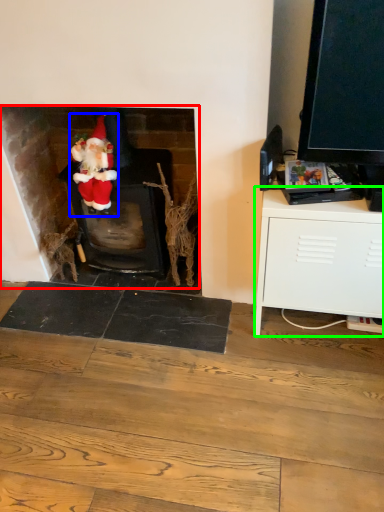
Question: Considering the real-world distances, which object is farthest from fireplace (highlighted by a red box)? person (highlighted by a blue box) or cabinetry (highlighted by a green box)?

Choices:
 (A) person
 (B) cabinetry

Answer: (B)